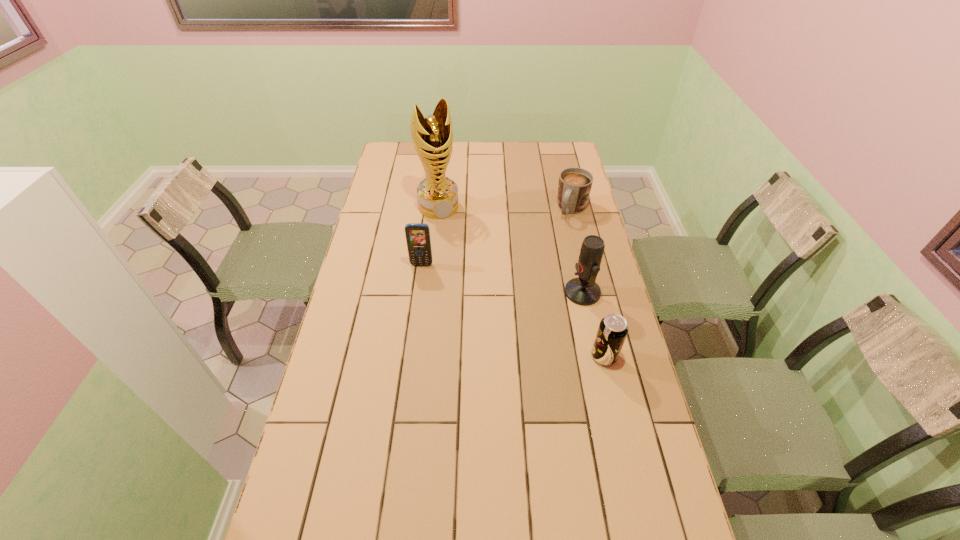
Locate an element on the screen. the third farthest object is located at coordinates pos(418,240).

This screenshot has width=960, height=540. Find the location of `soda can`. soda can is located at coordinates (612, 331).

Find the location of a particular element. the fourth shortest object is located at coordinates (583, 290).

The height and width of the screenshot is (540, 960). In order to click on microphone in this screenshot , I will do `click(583, 290)`.

This screenshot has height=540, width=960. In order to click on award in this screenshot , I will do `click(432, 136)`.

In order to click on mug in this screenshot , I will do [574, 187].

At what (x,y) coordinates should I click in order to perform the action: click on vacant point located on the screen of the third farthest object. Please return your answer as a coordinate pair (x, y). This screenshot has width=960, height=540. Looking at the image, I should click on (417, 306).

Identify the location of vacant region located on the front of the soda can. The image size is (960, 540). (611, 382).

Where is `free space located 0.330m on the side of the microphone with the red ring`? free space located 0.330m on the side of the microphone with the red ring is located at coordinates (472, 318).

You are a GUI agent. You are given a task and a screenshot of the screen. Output one action in this format:
    pyautogui.click(x=<x>, y=<y>)
    Task: Click on the vacant space situated on the side of the microphone with the red ring
    The image size is (960, 540).
    Given the screenshot: What is the action you would take?
    pyautogui.click(x=499, y=312)